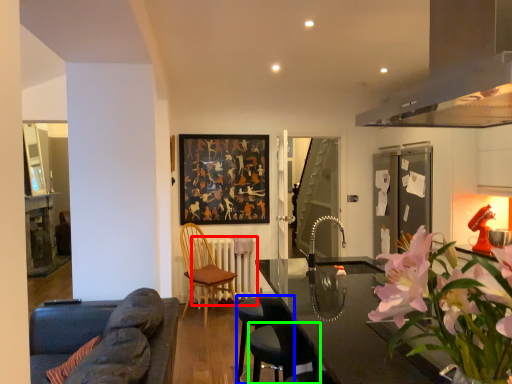
Question: Estimate the real-world distances between objects in this image. Which object is closer to radiator (highlighted by a red box), bar stool (highlighted by a blue box) or bar stool (highlighted by a green box)?

Choices:
 (A) bar stool
 (B) bar stool

Answer: (A)